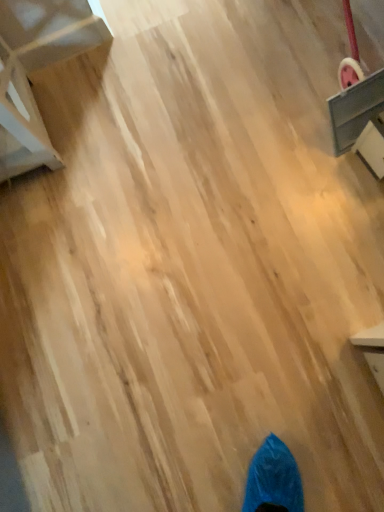
Question: From their relative heights in the image, would you say gray fabric drawer at upper right, positioned as the 2th furniture in left-to-right order, is taller or shorter than white matte chair at upper left, positioned as the 1th furniture in left-to-right order?

Choices:
 (A) short
 (B) tall

Answer: (B)

Question: Considering the positions of gray fabric drawer at upper right, positioned as the 2th furniture in left-to-right order, and white matte chair at upper left, positioned as the 1th furniture in left-to-right order, in the image, is gray fabric drawer at upper right, positioned as the 2th furniture in left-to-right order, bigger or smaller than white matte chair at upper left, positioned as the 1th furniture in left-to-right order,?

Choices:
 (A) big
 (B) small

Answer: (B)

Question: Visually, is gray fabric drawer at upper right, arranged as the 1th furniture when viewed from the right, positioned to the left or to the right of white matte chair at upper left, the second furniture viewed from the right?

Choices:
 (A) right
 (B) left

Answer: (A)

Question: Is point (97, 14) closer or farther from the camera than point (337, 118)?

Choices:
 (A) farther
 (B) closer

Answer: (A)

Question: Relative to gray fabric drawer at upper right, positioned as the 2th furniture in left-to-right order, is white matte chair at upper left, positioned as the 1th furniture in left-to-right order, in front or behind?

Choices:
 (A) front
 (B) behind

Answer: (A)

Question: Would you say white matte chair at upper left, the second furniture viewed from the right, is to the left or to the right of gray fabric drawer at upper right, arranged as the 1th furniture when viewed from the right, in the picture?

Choices:
 (A) right
 (B) left

Answer: (B)

Question: From the image's perspective, relative to gray fabric drawer at upper right, arranged as the 1th furniture when viewed from the right, is white matte chair at upper left, positioned as the 1th furniture in left-to-right order, above or below?

Choices:
 (A) below
 (B) above

Answer: (A)